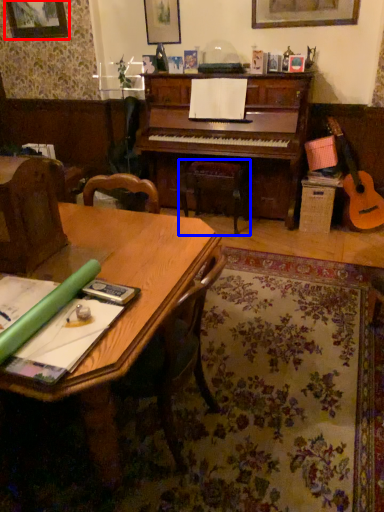
Question: Which point is closer to the camera, picture frame (highlighted by a red box) or music stool (highlighted by a blue box)?

Choices:
 (A) picture frame
 (B) music stool

Answer: (B)